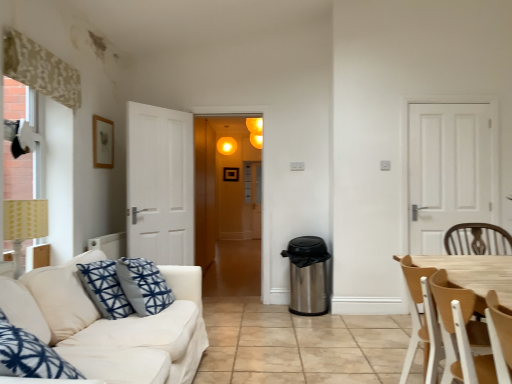
Question: From the image's perspective, is blue printed cushion at left, positioned as the first pillow in right-to-left order, on top of white fabric couch at lower left?

Choices:
 (A) no
 (B) yes

Answer: (B)

Question: Does blue printed cushion at left, which ranks as the 2th pillow in left-to-right order, have a lesser height compared to white fabric couch at lower left?

Choices:
 (A) no
 (B) yes

Answer: (B)

Question: Is blue printed cushion at left, which ranks as the 2th pillow in left-to-right order, touching white fabric couch at lower left?

Choices:
 (A) yes
 (B) no

Answer: (B)

Question: From a real-world perspective, is blue printed cushion at left, positioned as the first pillow in right-to-left order, positioned over white fabric couch at lower left based on gravity?

Choices:
 (A) no
 (B) yes

Answer: (B)

Question: Is blue printed cushion at left, which ranks as the 2th pillow in left-to-right order, far from white fabric couch at lower left?

Choices:
 (A) yes
 (B) no

Answer: (B)

Question: In terms of width, does matte yellow light at upper center look wider or thinner when compared to matte yellow lampshade at left?

Choices:
 (A) wide
 (B) thin

Answer: (B)

Question: Is matte yellow light at upper center bigger or smaller than matte yellow lampshade at left?

Choices:
 (A) big
 (B) small

Answer: (B)

Question: Is point (248, 129) positioned closer to the camera than point (19, 266)?

Choices:
 (A) farther
 (B) closer

Answer: (A)

Question: Relative to matte yellow lampshade at left, is matte yellow light at upper center in front or behind?

Choices:
 (A) front
 (B) behind

Answer: (B)

Question: Choose the correct answer: Is white matte door at right inside matte yellow light at upper center or outside it?

Choices:
 (A) inside
 (B) outside

Answer: (B)

Question: Considering the positions of white matte door at right and matte yellow light at upper center in the image, is white matte door at right taller or shorter than matte yellow light at upper center?

Choices:
 (A) short
 (B) tall

Answer: (B)

Question: From a real-world perspective, is white matte door at right positioned above or below matte yellow light at upper center?

Choices:
 (A) below
 (B) above

Answer: (A)

Question: Considering the positions of white matte door at right and matte yellow light at upper center in the image, is white matte door at right wider or thinner than matte yellow light at upper center?

Choices:
 (A) wide
 (B) thin

Answer: (B)

Question: Is point (41, 322) closer or farther from the camera than point (23, 203)?

Choices:
 (A) farther
 (B) closer

Answer: (B)

Question: Is blue printed cushion at lower left, positioned as the 2th pillow in right-to-left order, situated inside matte yellow lampshade at left or outside?

Choices:
 (A) outside
 (B) inside

Answer: (A)